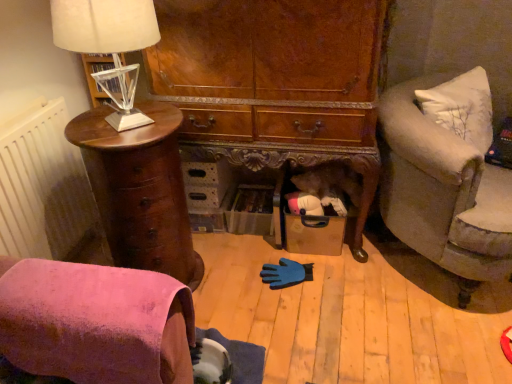
Question: Looking at their shapes, would you say white fabric lampshade at left is wider or thinner than mahogany wood chest of drawers at left?

Choices:
 (A) thin
 (B) wide

Answer: (A)

Question: Is point (94, 0) positioned closer to the camera than point (195, 279)?

Choices:
 (A) closer
 (B) farther

Answer: (A)

Question: Which of these objects is positioned closest to the white textured radiator at left?

Choices:
 (A) velvet gray couch at right
 (B) white fabric lampshade at left
 (C) mahogany wood chest of drawers at left
 (D) pink suede chair at lower left

Answer: (C)

Question: Which object is positioned farthest from the mahogany wood chest of drawers at left?

Choices:
 (A) pink suede chair at lower left
 (B) white fabric lampshade at left
 (C) velvet gray couch at right
 (D) white textured radiator at left

Answer: (C)